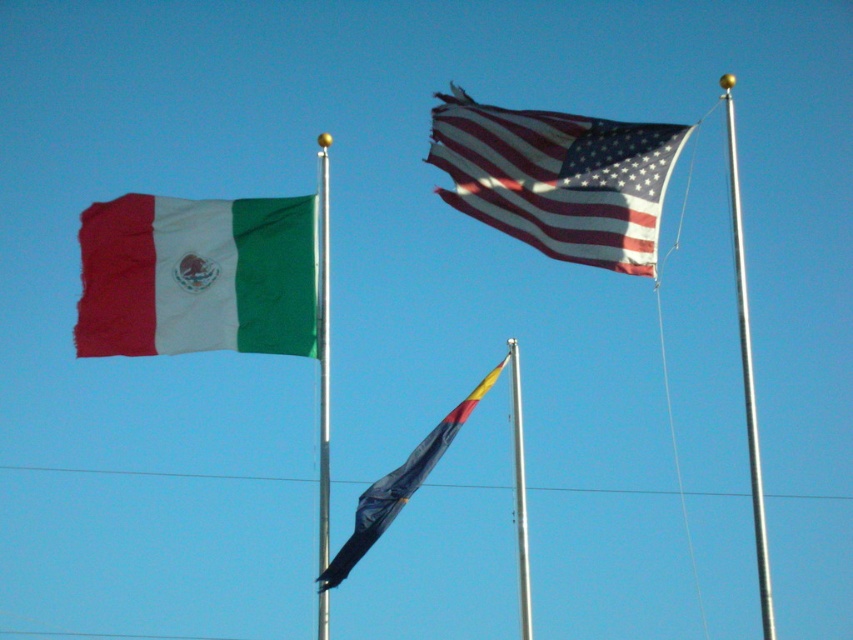
Question: Is rippled fabric flag at upper center bigger than dark blue fabric flag at center?

Choices:
 (A) no
 (B) yes

Answer: (A)

Question: Among these objects, which one is farthest from the camera?

Choices:
 (A) silver metallic flag pole at center
 (B) rippled fabric flag at upper center
 (C) silver metallic pole at center
 (D) dark blue fabric flag at center

Answer: (B)

Question: Can you confirm if silver metallic pole at upper center is positioned to the left of silver metallic flag pole at center?

Choices:
 (A) no
 (B) yes

Answer: (A)

Question: Which object appears closest to the camera in this image?

Choices:
 (A) silver metallic pole at center
 (B) silver metallic flag pole at center
 (C) dark blue fabric flag at center

Answer: (A)

Question: Which point is farther to the camera?

Choices:
 (A) (526, 616)
 (B) (328, 176)

Answer: (B)

Question: Is silver metallic pole at upper center to the left of silver metallic flag pole at center from the viewer's perspective?

Choices:
 (A) yes
 (B) no

Answer: (B)